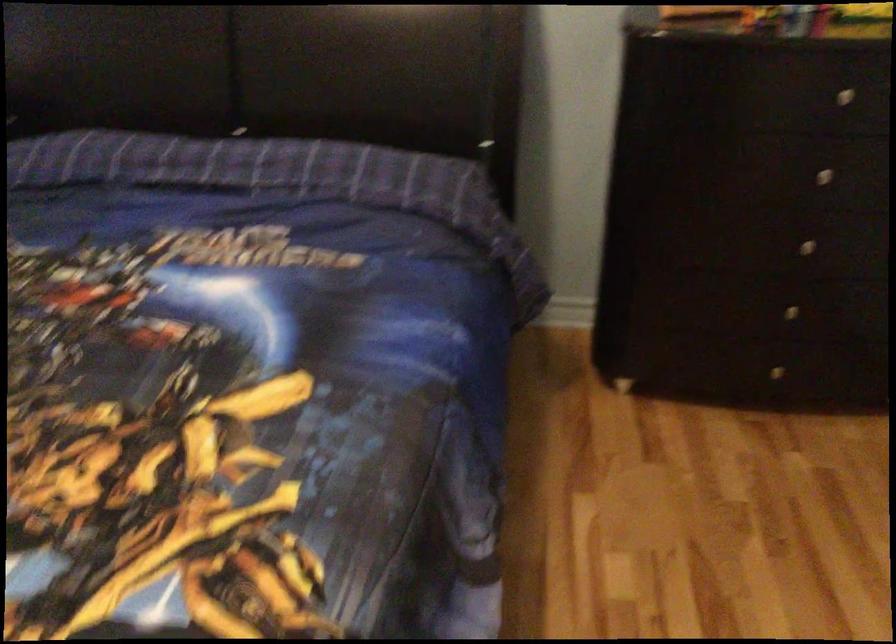
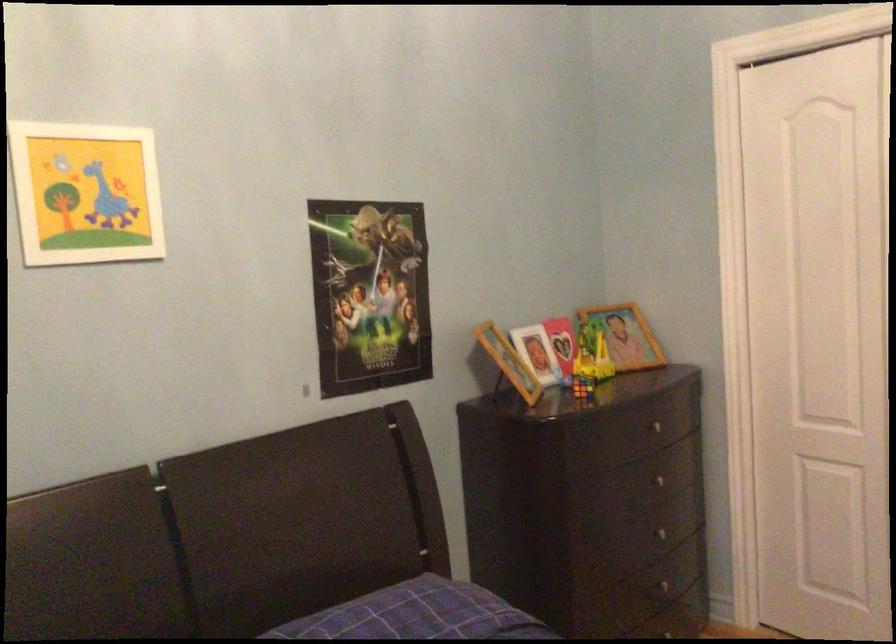
The point at (799, 238) is marked in the first image. Where is the corresponding point in the second image?

(667, 532)